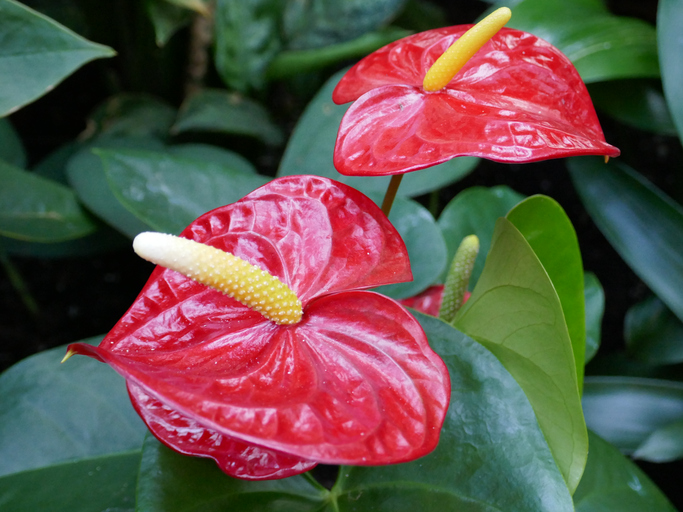
In order to click on left corner in this screenshot , I will do `click(8, 3)`.